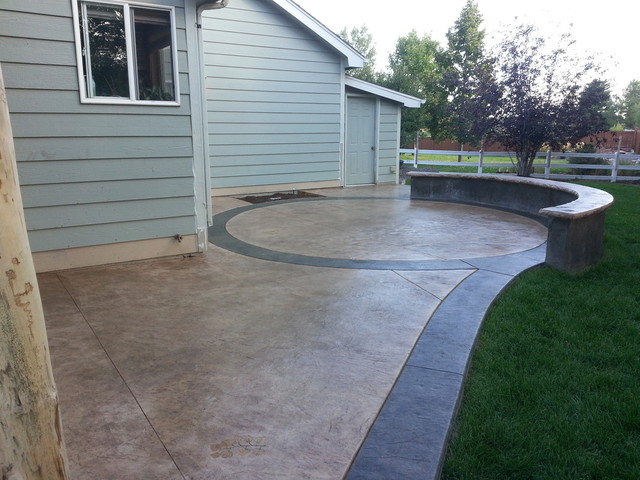
Find the location of a particular element. The width and height of the screenshot is (640, 480). door is located at coordinates (363, 131).